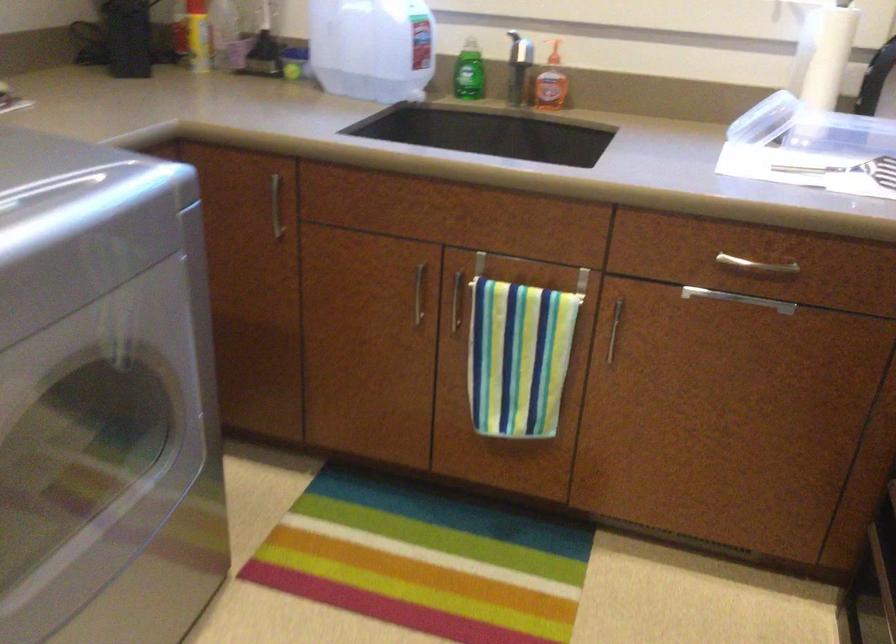
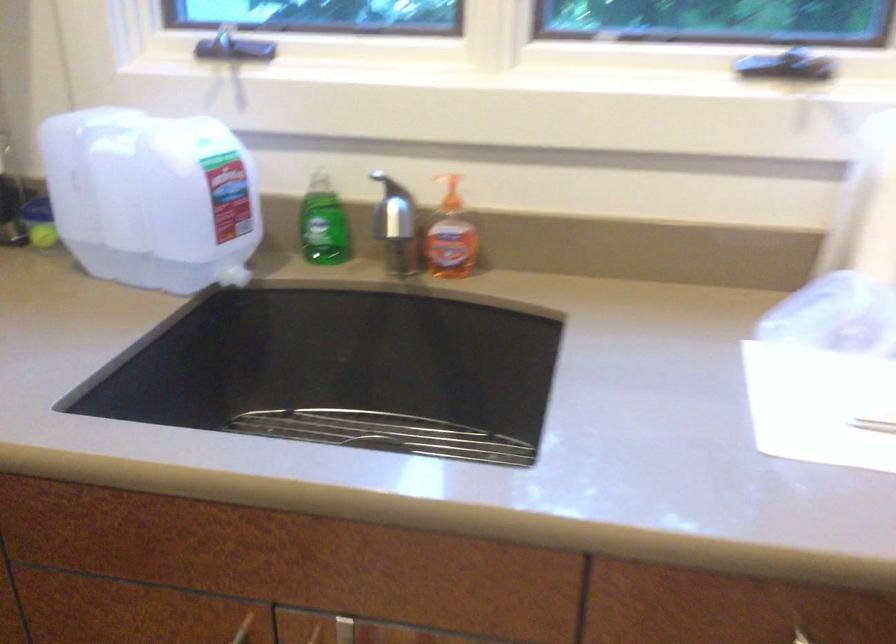
The point at (423, 266) is marked in the first image. Where is the corresponding point in the second image?

(243, 629)